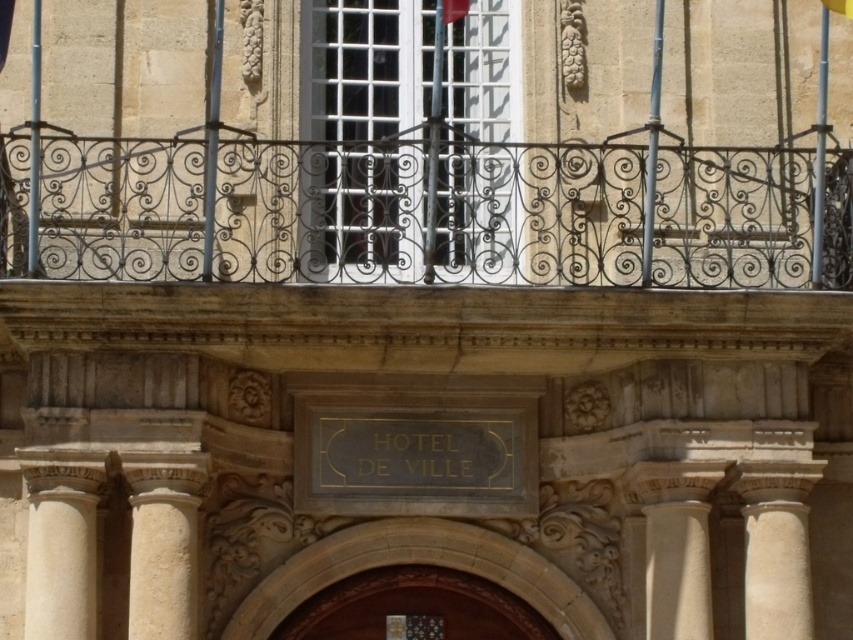
You are standing in front of the building shown in the scene. The wooden door at center is located at point (415,609). If you want to enter the building, which direction should you walk towards?

The wooden door at center is located at point (415,609), so you should walk towards the center of the building to enter.

You are a painter who needs to decide which object to paint first. Since you want to start with the taller object, which one should you choose between the wooden door at center and the white marble column at lower left?

The white marble column at lower left is taller than the wooden door at center, so you should paint the white marble column at lower left first.